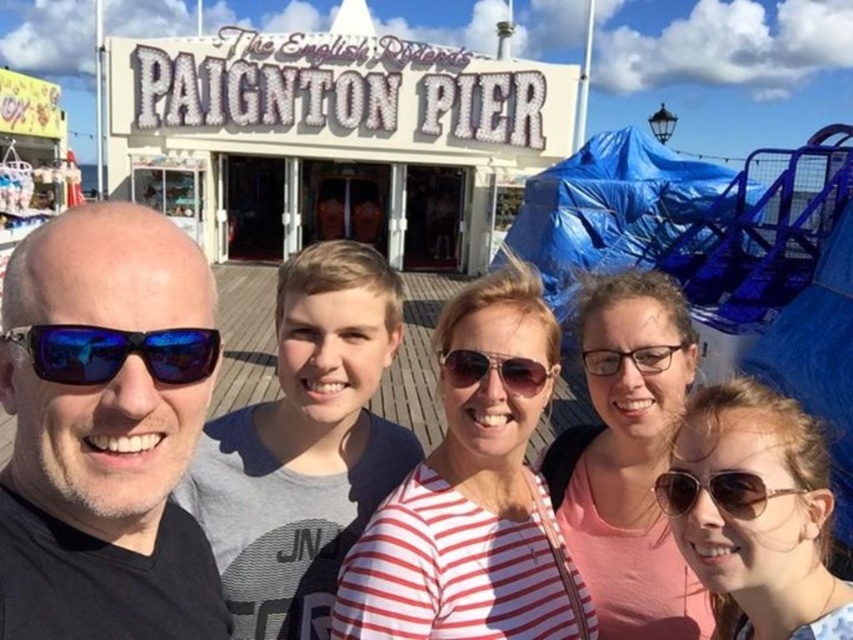
Question: Which point appears farthest from the camera in this image?

Choices:
 (A) (637, 364)
 (B) (506, 381)
 (C) (668, 474)
 (D) (579, 380)

Answer: (D)

Question: Which object is positioned closest to the transparent plastic glasses at center?

Choices:
 (A) matte black sunglasses at center
 (B) blue reflective lens sunglasses at left
 (C) gold metallic sunglasses at lower right

Answer: (A)

Question: Which point is farther to the camera?

Choices:
 (A) blue reflective lens sunglasses at left
 (B) matte black sunglasses at center
 (C) striped cotton shirt at center

Answer: (B)

Question: Does blue reflective lens sunglasses at left appear on the right side of matte black sunglasses at center?

Choices:
 (A) no
 (B) yes

Answer: (A)

Question: Can you confirm if gold metallic sunglasses at lower right is positioned below matte black sunglasses at center?

Choices:
 (A) no
 (B) yes

Answer: (B)

Question: Does gold metallic sunglasses at lower right have a smaller size compared to transparent plastic glasses at center?

Choices:
 (A) yes
 (B) no

Answer: (B)